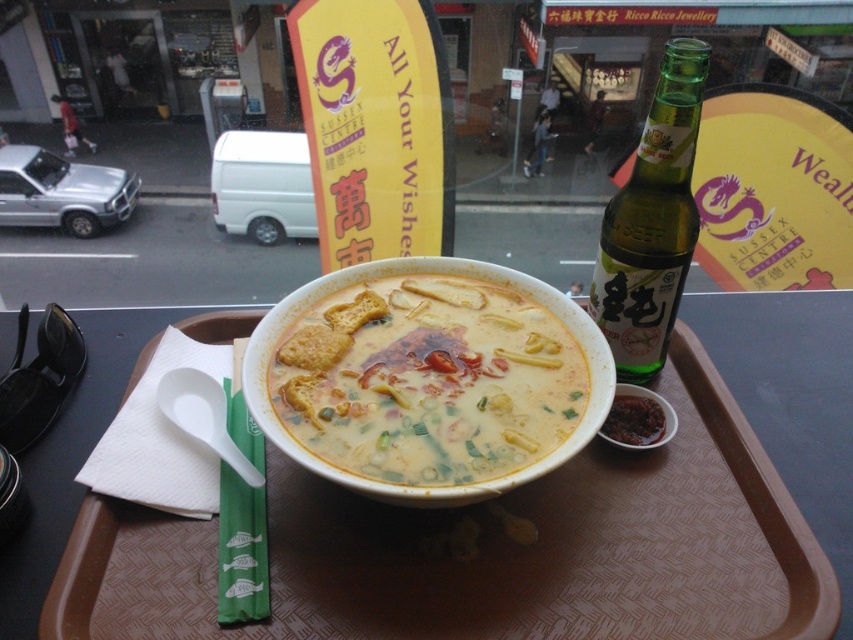
Question: Among these points, which one is nearest to the camera?

Choices:
 (A) (520, 349)
 (B) (424, 627)
 (C) (631, 403)

Answer: (B)

Question: Is yellow creamy soup at center further to camera compared to dark red paste at bowl right?

Choices:
 (A) no
 (B) yes

Answer: (A)

Question: Which object appears farthest from the camera in this image?

Choices:
 (A) yellow creamy soup at center
 (B) green glass bottle at upper right
 (C) brown plastic tray at center

Answer: (B)

Question: Is brown plastic tray at center smaller than green glass bottle at upper right?

Choices:
 (A) yes
 (B) no

Answer: (B)

Question: Is yellow creamy soup at center smaller than green glass bottle at upper right?

Choices:
 (A) no
 (B) yes

Answer: (A)

Question: Which object appears farthest from the camera in this image?

Choices:
 (A) brown plastic tray at center
 (B) green glass bottle at upper right
 (C) dark red paste at bowl right

Answer: (C)